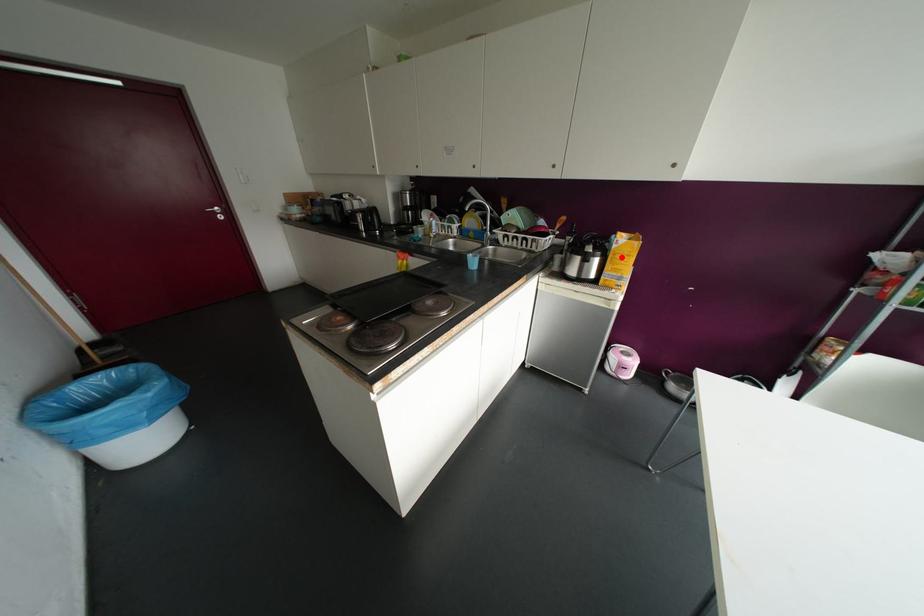
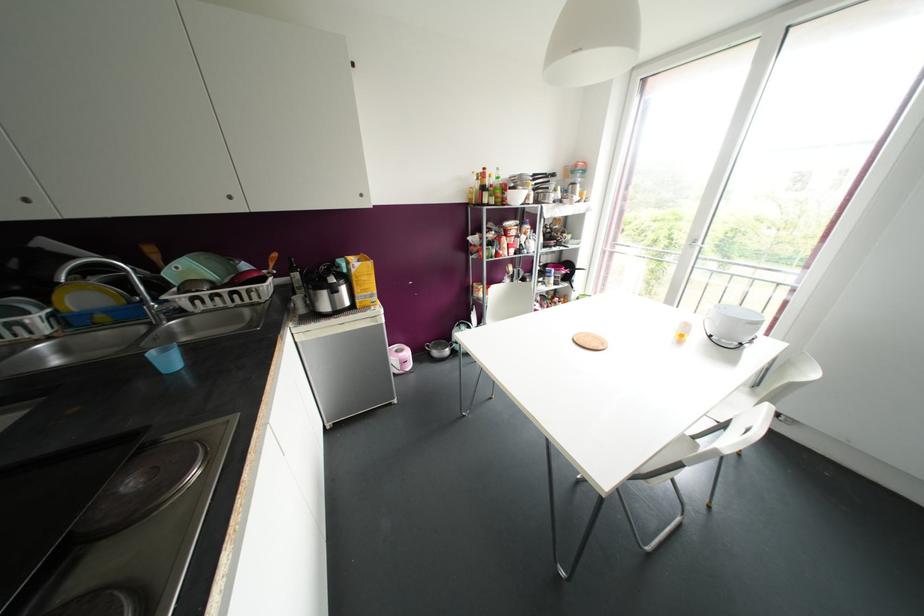
The point at the highlighted location is marked in the first image. Where is the corresponding point in the second image?

(363, 277)